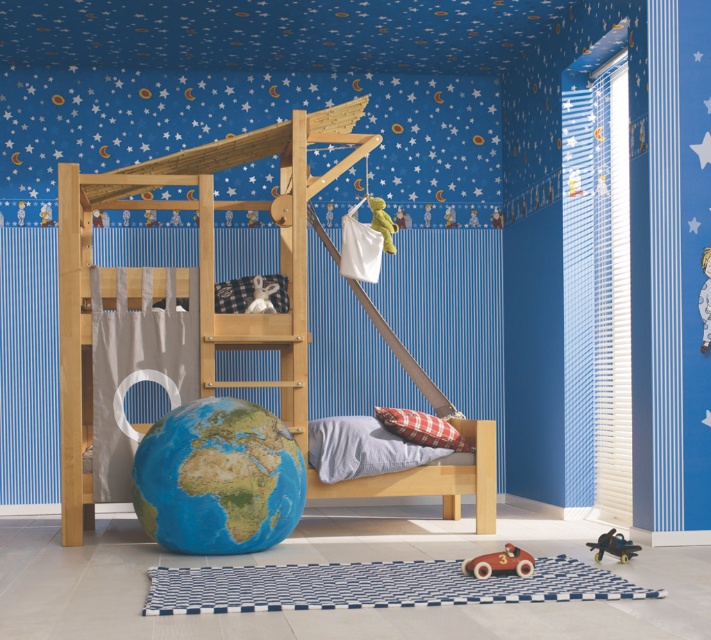
You are a parent trying to place a new nightstand in your child bedroom. The nightstand is 20 inches wide. You want to place it between the earth globe at center and the light wood bed at center. Can you fit the nightstand there?

The distance between the earth globe at center and the light wood bed at center is 31.46 inches. Since the nightstand is 20 inches wide, there is enough space to fit it between them as 20 inches is less than 31.46 inches.

You are a child who wants to reach both the wooden toy car at lower center and the soft yellow plush at center. Which one is easier to reach without moving your position?

The wooden toy car at lower center is located below the soft yellow plush at center, so it is easier to reach without moving your position.

You are standing in the center of the child bedroom and see two points marked on the wall. The first point is at coordinates point (90, 381) and the second point is at coordinates point (523, 550). Which point is closer to you?

Point (90, 381) is closer to you because it is further to the camera than point (523, 550).